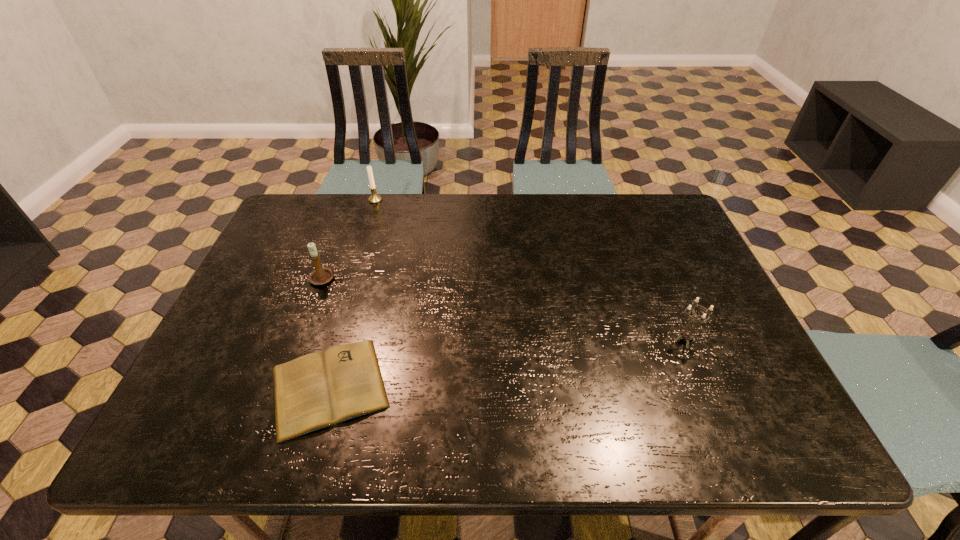
Identify the location of empty location between the farthest candle holder and the nearest candle holder. This screenshot has height=540, width=960. click(530, 270).

Locate an element on the screen. vacant space in between the rightmost candle holder and the shortest object is located at coordinates (507, 363).

Identify the location of vacant point located between the nearest candle holder and the second candle holder from right to left. (530, 270).

Locate an element on the screen. The width and height of the screenshot is (960, 540). vacant space that is in between the nearest candle holder and the second nearest candle holder is located at coordinates (505, 309).

This screenshot has height=540, width=960. What are the coordinates of `free space that is in between the second candle holder from left to right and the rightmost object` in the screenshot? It's located at (530, 270).

You are a GUI agent. You are given a task and a screenshot of the screen. Output one action in this format:
    pyautogui.click(x=<x>, y=<y>)
    Task: Click on the free point between the second nearest candle holder and the book
    The image size is (960, 540).
    Given the screenshot: What is the action you would take?
    pyautogui.click(x=327, y=333)

At what (x,y) coordinates should I click in order to perform the action: click on free space between the book and the farthest object. Please return your answer as a coordinate pair (x, y). The width and height of the screenshot is (960, 540). Looking at the image, I should click on (352, 294).

This screenshot has height=540, width=960. I want to click on free spot between the rightmost object and the leftmost candle holder, so click(505, 309).

At what (x,y) coordinates should I click in order to perform the action: click on free space between the shortest object and the second farthest object. Please return your answer as a coordinate pair (x, y). Looking at the image, I should click on (327, 333).

Image resolution: width=960 pixels, height=540 pixels. I want to click on free point between the farthest candle holder and the leftmost candle holder, so click(350, 239).